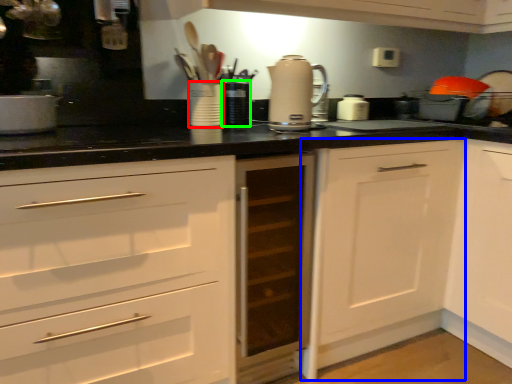
Question: Based on their relative distances, which object is farther from appliance (highlighted by a red box)? Choose from cabinetry (highlighted by a blue box) and appliance (highlighted by a green box).

Choices:
 (A) cabinetry
 (B) appliance

Answer: (A)